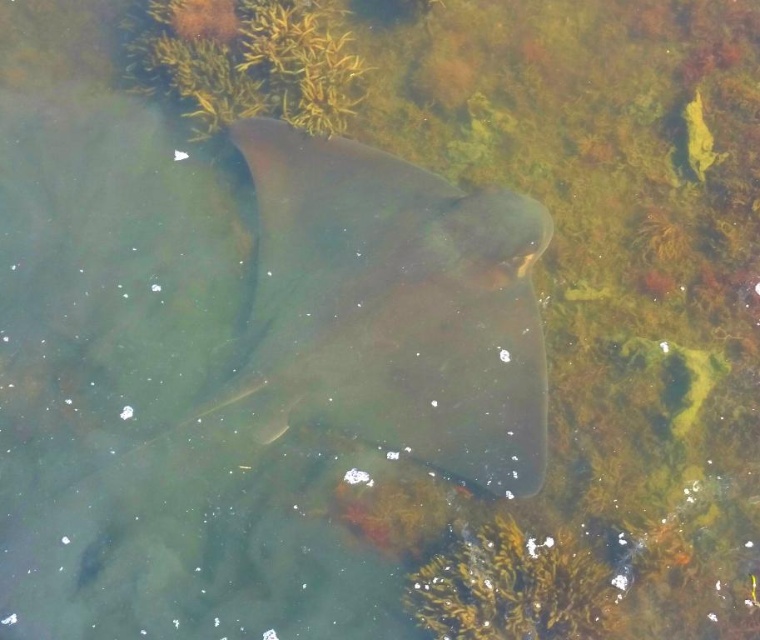
You are a marine biologist observing the image of the underwater scene. You notice a point marked at coordinates (394, 307). What object in the scene is located at this point?

The point at coordinates (394, 307) marks the smooth gray stingray at center.

You are a marine biologist observing the stingray from a submarine. The submarine has a robotic arm that can extend up to 10 feet. You need to collect a sample from the point labeled as point (x=342, y=346). Can the robotic arm reach that point?

The point labeled point (x=342, y=346) is 9.35 feet away from the camera. Since the robotic arm can extend up to 10 feet, it can reach the point labeled point (x=342, y=346).